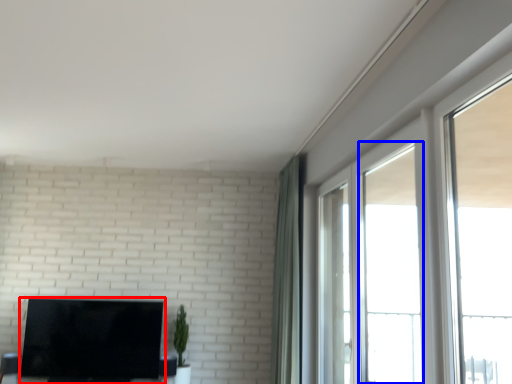
Question: Among these objects, which one is farthest to the camera, television (highlighted by a red box) or window (highlighted by a blue box)?

Choices:
 (A) television
 (B) window

Answer: (A)